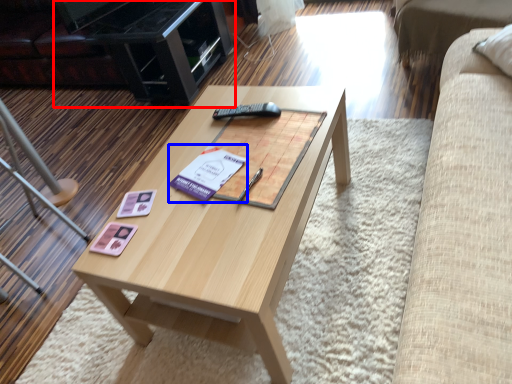
Question: Which point is further to the camera, entertainment center (highlighted by a red box) or paperback book (highlighted by a blue box)?

Choices:
 (A) entertainment center
 (B) paperback book

Answer: (A)